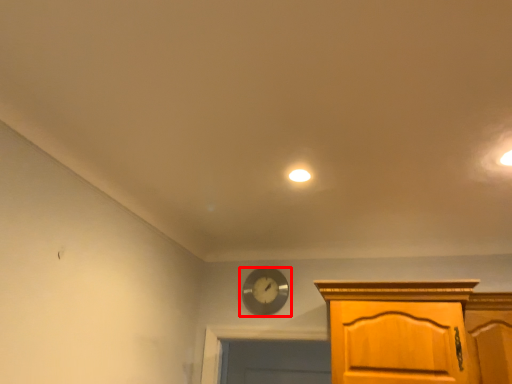
Question: From the image's perspective, where is wall clock (annotated by the red box) located relative to lighting?

Choices:
 (A) above
 (B) below

Answer: (B)